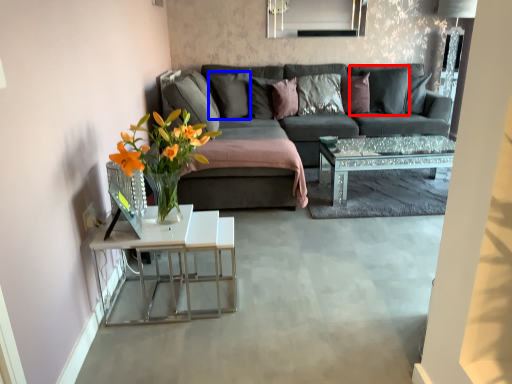
Question: Which object is further to the camera taking this photo, pillow (highlighted by a red box) or pillow (highlighted by a blue box)?

Choices:
 (A) pillow
 (B) pillow

Answer: (A)